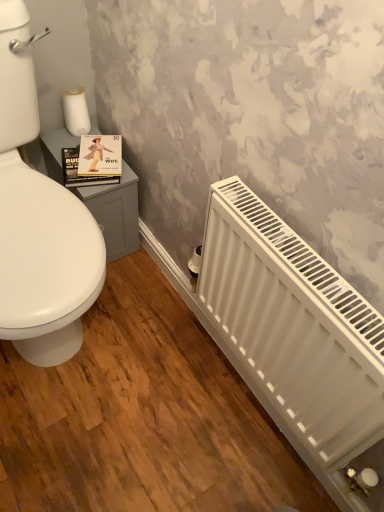
Question: In the image, is matte paper book at upper left positioned in front of or behind white matte toilet paper at upper left?

Choices:
 (A) front
 (B) behind

Answer: (A)

Question: From the image's perspective, is matte paper book at upper left positioned above or below white matte toilet paper at upper left?

Choices:
 (A) above
 (B) below

Answer: (B)

Question: Which object is the farthest from the white matte toilet paper at upper left?

Choices:
 (A) matte paper book at upper left
 (B) white matte radiator at lower right

Answer: (B)

Question: Estimate the real-world distances between objects in this image. Which object is closer to the matte paper book at upper left?

Choices:
 (A) white matte radiator at lower right
 (B) white matte toilet paper at upper left

Answer: (B)